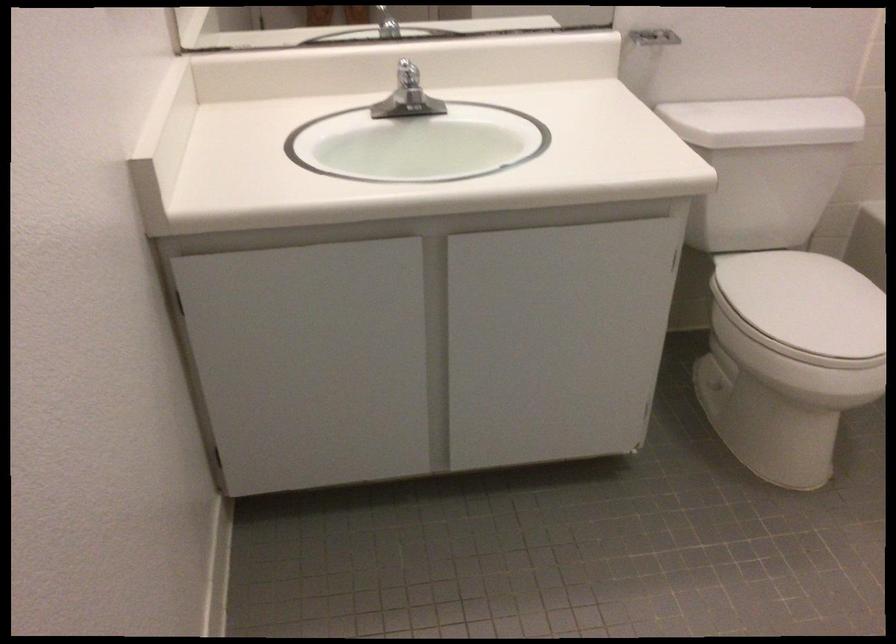
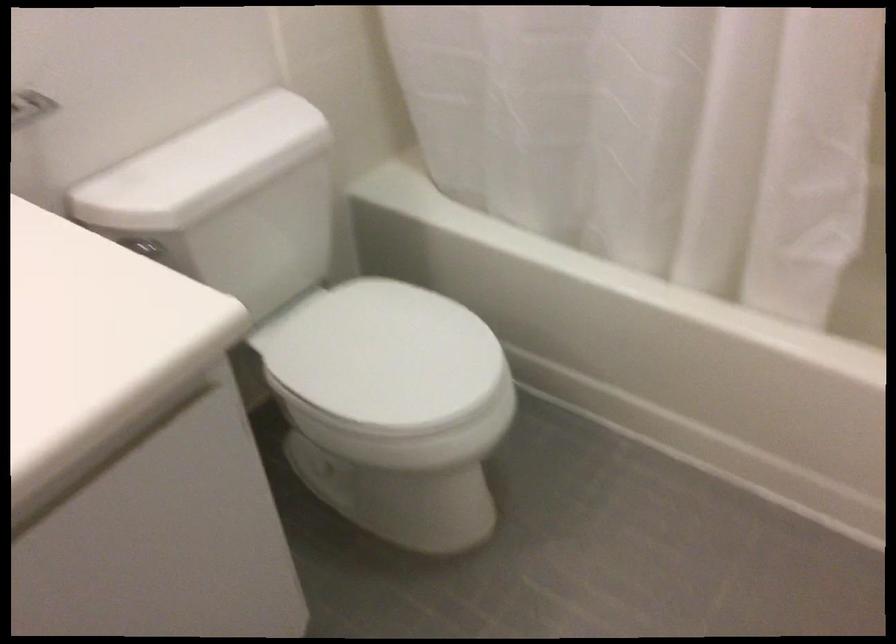
Question: Based on the continuous images, in which direction is the camera rotating? Reply with the corresponding letter.

Choices:
 (A) Left
 (B) Right
 (C) Up
 (D) Down

Answer: (B)